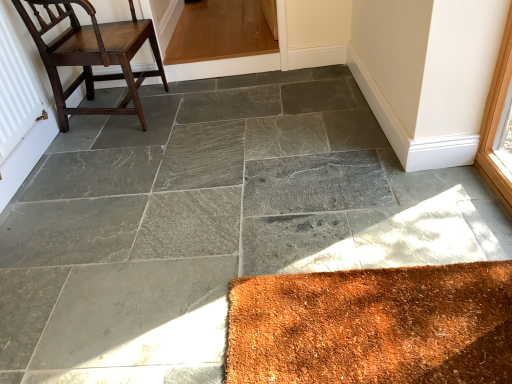
You are a GUI agent. You are given a task and a screenshot of the screen. Output one action in this format:
    pyautogui.click(x=<x>, y=<y>)
    Task: Click on the vacant space to the right of dark brown wood chair at left
    Image resolution: width=512 pixels, height=384 pixels.
    Given the screenshot: What is the action you would take?
    pyautogui.click(x=199, y=108)